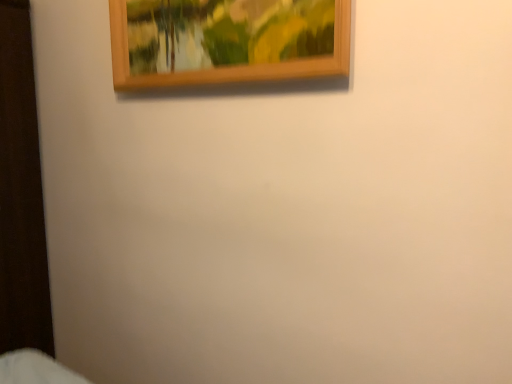
I want to click on wooden picture frame at upper center, so click(227, 41).

The height and width of the screenshot is (384, 512). What do you see at coordinates (227, 41) in the screenshot?
I see `wooden picture frame at upper center` at bounding box center [227, 41].

At what (x,y) coordinates should I click in order to perform the action: click on wooden picture frame at upper center. Please return your answer as a coordinate pair (x, y). The image size is (512, 384). Looking at the image, I should click on (227, 41).